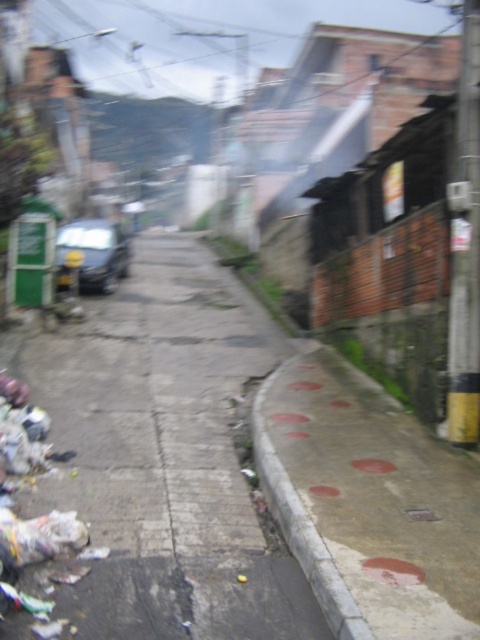
Question: Among these points, which one is farthest from the camera?

Choices:
 (A) (47, 547)
 (B) (264, 472)
 (C) (156, 468)

Answer: (C)

Question: Which point is farther to the camera?

Choices:
 (A) concrete curb at lower right
 (B) white plastic bag at lower left

Answer: (B)

Question: Is the position of concrete sidewalk at center less distant than that of white plastic bag at lower left?

Choices:
 (A) yes
 (B) no

Answer: (A)

Question: Where is concrete sidewalk at center located in relation to concrete curb at lower right in the image?

Choices:
 (A) right
 (B) left

Answer: (B)

Question: Which of the following is the closest to the observer?

Choices:
 (A) (319, 346)
 (B) (38, 554)
 (C) (92, 403)

Answer: (B)

Question: Can you confirm if concrete sidewalk at center is positioned to the left of white plastic bag at lower left?

Choices:
 (A) yes
 (B) no

Answer: (B)